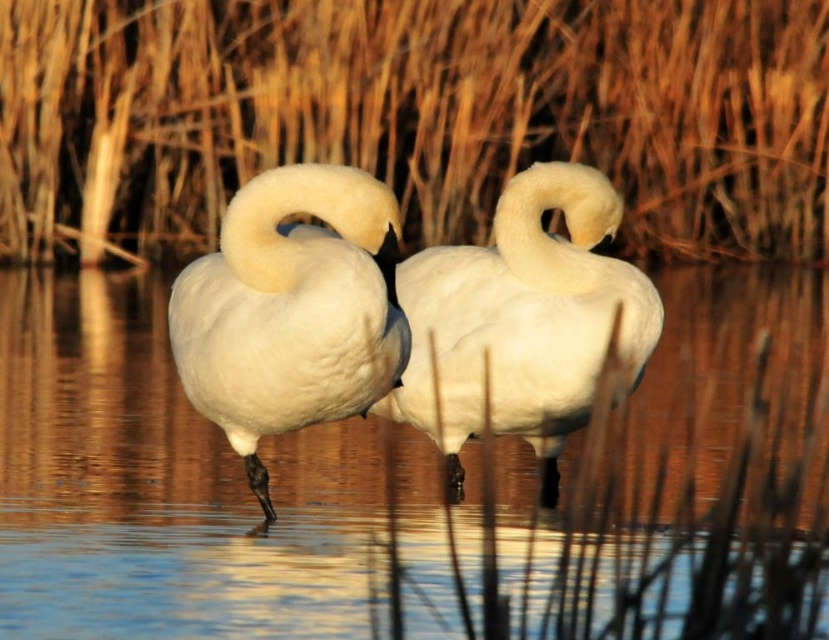
Question: Is brown grass at center thinner than white matte swan at center?

Choices:
 (A) no
 (B) yes

Answer: (B)

Question: Which point appears closest to the camera in this image?

Choices:
 (A) (579, 216)
 (B) (672, 22)
 (C) (250, 365)
 (D) (41, 609)

Answer: (C)

Question: Estimate the real-world distances between objects in this image. Which object is farther from the white matte swan at center?

Choices:
 (A) brown grass at center
 (B) clear water at center
 (C) white fluffy swan at center

Answer: (A)

Question: Can you confirm if clear water at center is smaller than white fluffy swan at center?

Choices:
 (A) yes
 (B) no

Answer: (B)

Question: Is white fluffy swan at center closer to camera compared to white matte swan at center?

Choices:
 (A) yes
 (B) no

Answer: (A)

Question: Which object appears closest to the camera in this image?

Choices:
 (A) white fluffy swan at center
 (B) clear water at center

Answer: (B)